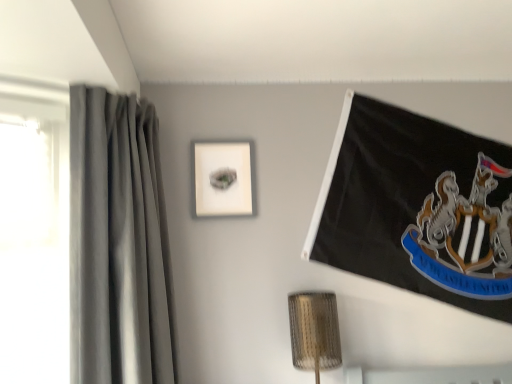
Question: From the image's perspective, is matte white picture frame at center positioned above or below gray fabric curtain at left?

Choices:
 (A) above
 (B) below

Answer: (A)

Question: Based on their sizes in the image, would you say matte white picture frame at center is bigger or smaller than gray fabric curtain at left?

Choices:
 (A) small
 (B) big

Answer: (A)

Question: From a real-world perspective, is matte white picture frame at center above or below gray fabric curtain at left?

Choices:
 (A) above
 (B) below

Answer: (A)

Question: In the image, is gray fabric curtain at left on the left side or the right side of matte white picture frame at center?

Choices:
 (A) left
 (B) right

Answer: (A)

Question: From their relative heights in the image, would you say gray fabric curtain at left is taller or shorter than matte white picture frame at center?

Choices:
 (A) tall
 (B) short

Answer: (A)

Question: Considering the positions of point (141, 311) and point (221, 210), is point (141, 311) closer or farther from the camera than point (221, 210)?

Choices:
 (A) closer
 (B) farther

Answer: (A)

Question: Is gray fabric curtain at left wider or thinner than matte white picture frame at center?

Choices:
 (A) wide
 (B) thin

Answer: (A)